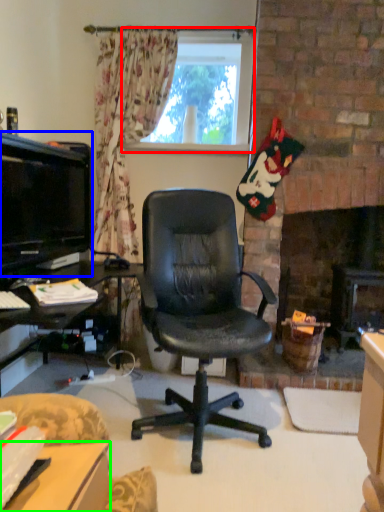
Question: Which object is the closest to the window (highlighted by a red box)? Choose among these: television (highlighted by a blue box) or desk (highlighted by a green box).

Choices:
 (A) television
 (B) desk

Answer: (A)